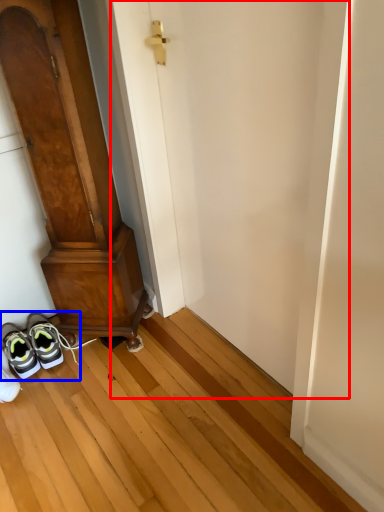
Question: Which object is closer to the camera taking this photo, door (highlighted by a red box) or footwear (highlighted by a blue box)?

Choices:
 (A) door
 (B) footwear

Answer: (A)